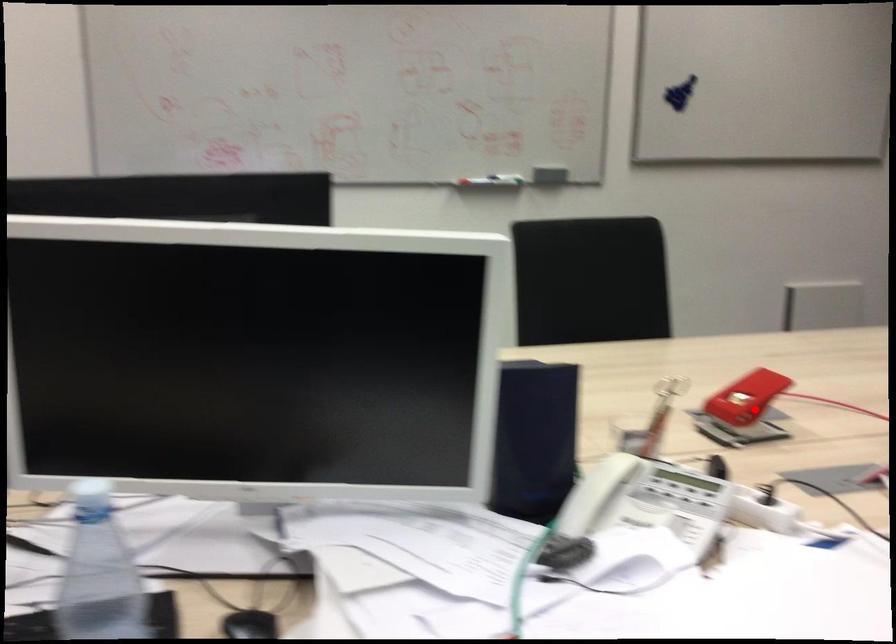
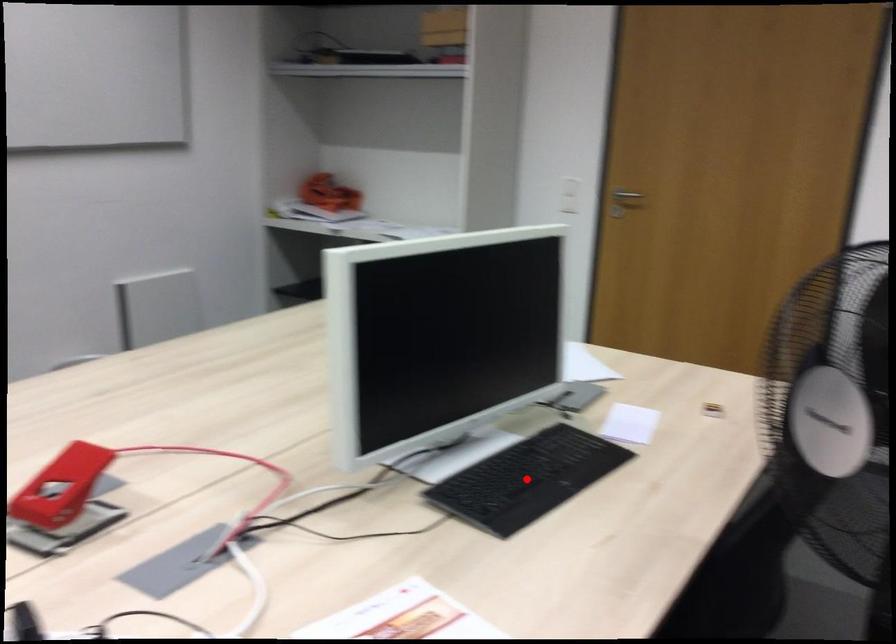
I am providing you with two images of the same scene from different viewpoints. A red point is marked on the first image and another point is marked on the second image. Does the point marked in image1 correspond to the same location as the one in image2?

No